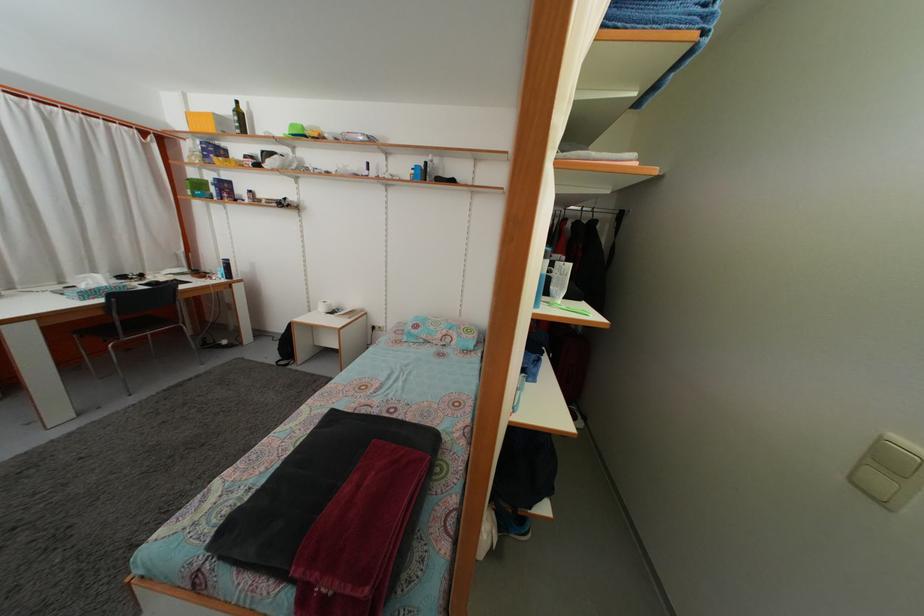
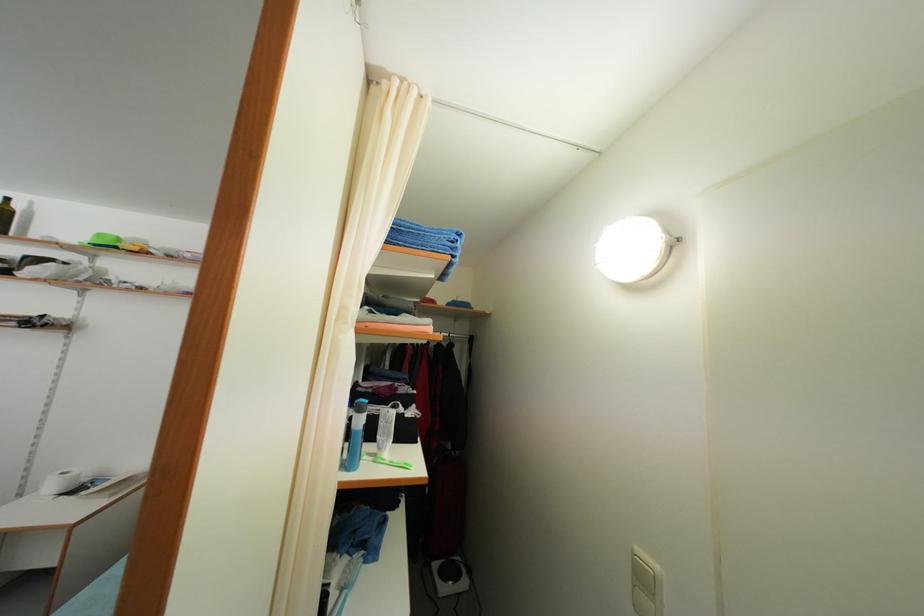
The point at (896, 469) is marked in the first image. Where is the corresponding point in the second image?

(649, 586)